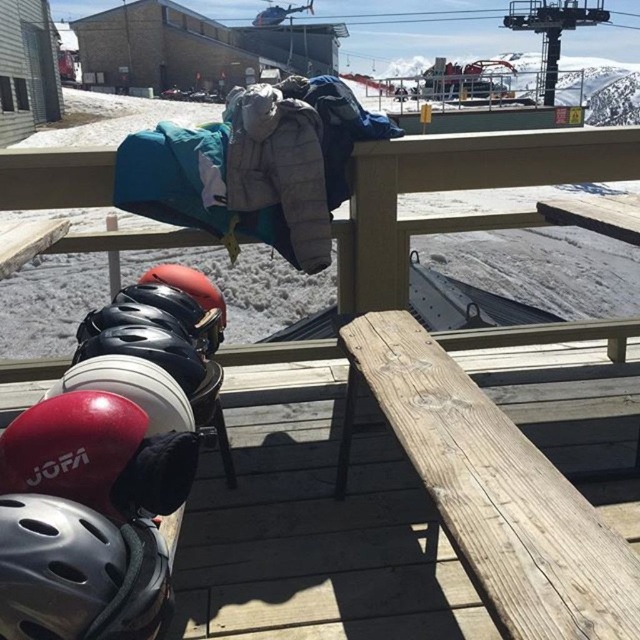
Is point (113, 589) positioned before point (100, 442)?

Yes.

Can you confirm if matte black helmet at lower left is shorter than shiny red helmet at lower left?

No, matte black helmet at lower left is not shorter than shiny red helmet at lower left.

Is point (86, 538) closer to camera compared to point (58, 406)?

Yes, point (86, 538) is in front of point (58, 406).

Locate an element on the screen. This screenshot has height=640, width=640. matte black helmet at lower left is located at coordinates (80, 572).

Which is above, matte black helmet at lower left or shiny black helmet at left?

shiny black helmet at left is higher up.

In the scene shown: Between matte black helmet at lower left and shiny black helmet at left, which one is positioned lower?

matte black helmet at lower left is lower down.

Is point (44, 500) behind point (145, 272)?

No, (44, 500) is in front of (145, 272).

At what (x,y) coordinates should I click in order to perform the action: click on matte black helmet at lower left. Please return your answer as a coordinate pair (x, y). The image size is (640, 640). Looking at the image, I should click on (80, 572).

Find the location of a particular element. The height and width of the screenshot is (640, 640). shiny red helmet at lower left is located at coordinates (72, 448).

Can you confirm if shiny red helmet at lower left is smaller than shiny black helmet at left?

Yes.

Between point (129, 436) and point (154, 280), which one is positioned behind?

Positioned behind is point (154, 280).

I want to click on shiny red helmet at lower left, so click(72, 448).